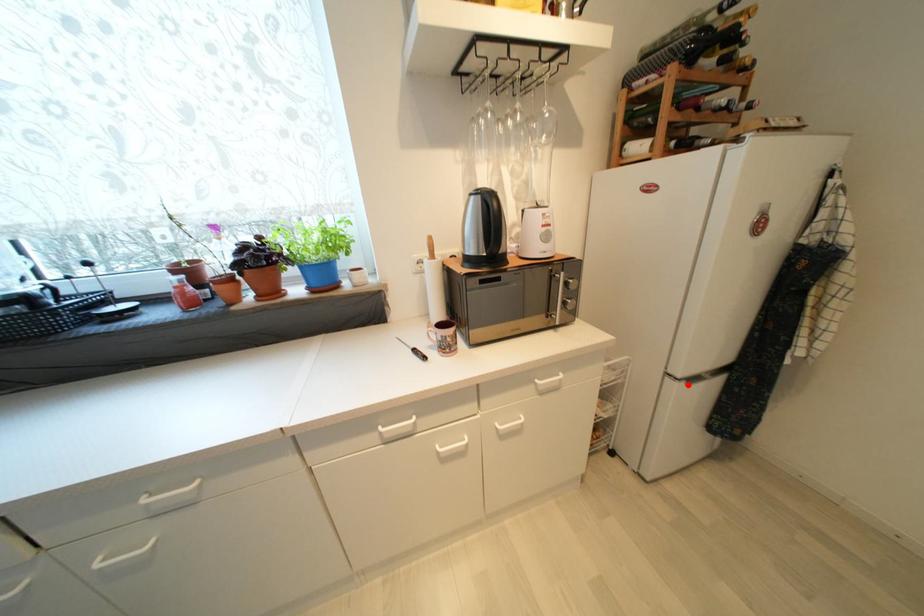
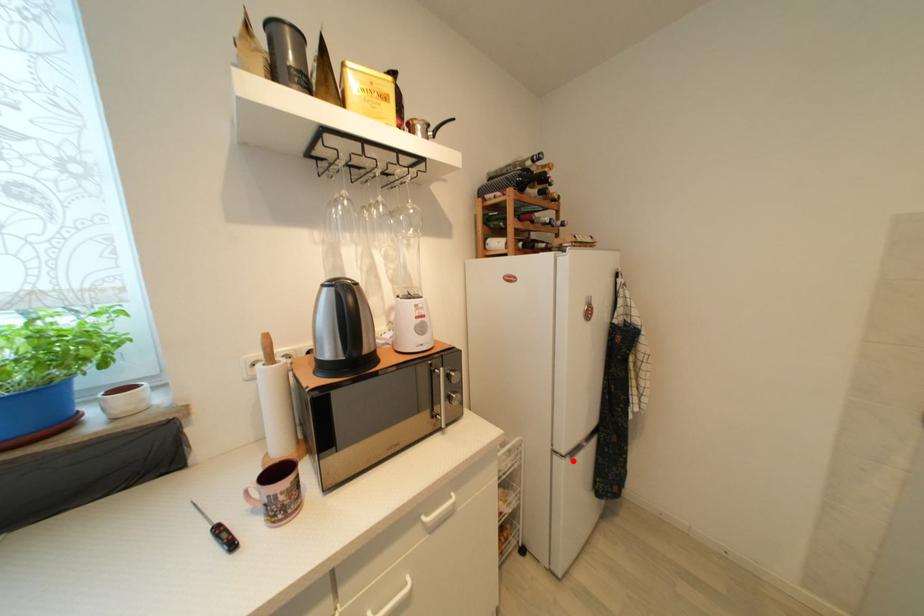
I am providing you with two images of the same scene from different viewpoints. A red point is marked on the first image and another point is marked on the second image. Is the marked point in image1 the same physical position as the marked point in image2?

Yes